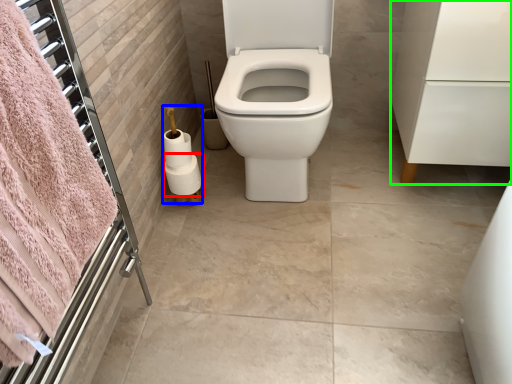
Question: Estimate the real-world distances between objects in this image. Which object is closer to toilet paper (highlighted by a red box), toilet paper (highlighted by a blue box) or porcelain (highlighted by a green box)?

Choices:
 (A) toilet paper
 (B) porcelain

Answer: (A)